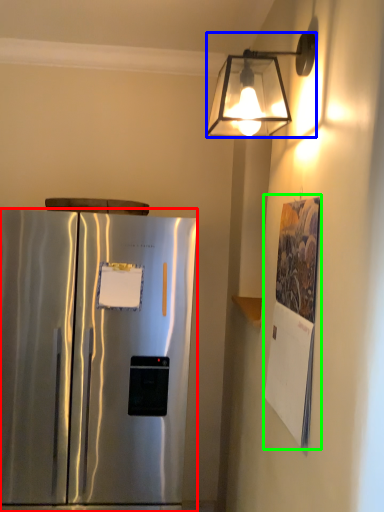
Question: Considering the real-world distances, which object is closest to refrigerator (highlighted by a red box)? lamp (highlighted by a blue box) or poster (highlighted by a green box).

Choices:
 (A) lamp
 (B) poster

Answer: (B)